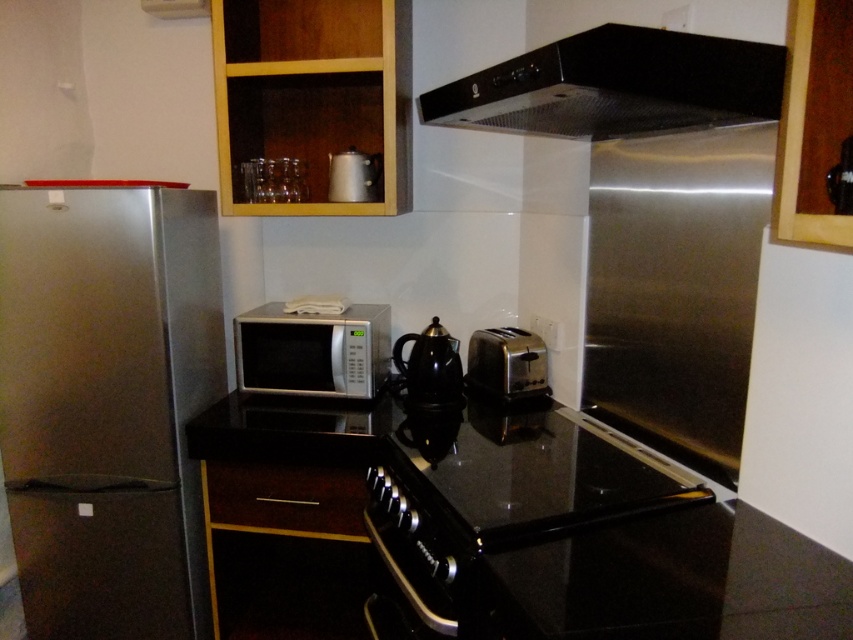
Based on the photo, you are standing in the kitchen and want to place a 20 inch wide baking tray on the black glossy countertop at center. Can you fit it without moving any items?

The distance between the black glossy countertop at center and the viewer is 39.31 inches, which is more than enough space to accommodate a 20 inch wide baking tray without needing to move any items.

In the scene shown: You are standing in the kitchen and want to move from the refrigerator to the microwave oven. The path goes through two points marked as point 1 at position [633,512] and point 2 at position [515,380]. Which point should you step on first?

You should step on point 1 at position [633,512] first because it is in front of point 2 at position [515,380], so you encounter it earlier along the path.